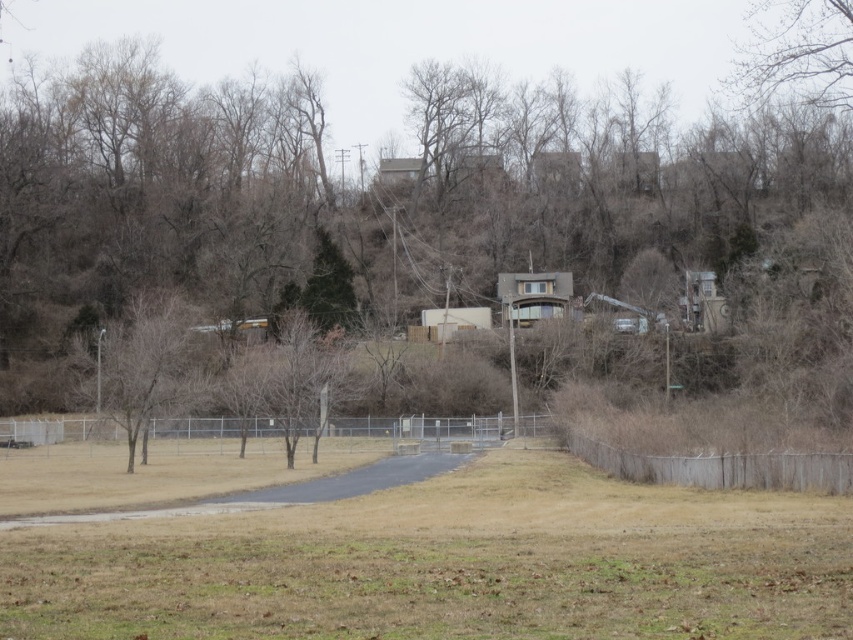
Is point (508, 268) farther from camera compared to point (126, 330)?

Yes, it is.

Who is more forward, (454, 148) or (103, 388)?

Positioned in front is point (103, 388).

Where is `brown textured tree at center`? This screenshot has width=853, height=640. brown textured tree at center is located at coordinates (437, 202).

Between brown textured tree at center and brown dry grass at lower center, which one is positioned higher?

Positioned higher is brown textured tree at center.

Between brown textured tree at center and brown dry grass at lower center, which one is positioned lower?

brown dry grass at lower center

Where is `brown textured tree at center`? brown textured tree at center is located at coordinates (437, 202).

Between point (653, 515) and point (134, 307), which one is positioned behind?

The point (134, 307) is behind.

Who is positioned more to the right, brown dry grass at lower center or brown leafless tree at left?

brown dry grass at lower center

Looking at this image, measure the distance between brown dry grass at lower center and camera.

brown dry grass at lower center and camera are 11.69 meters apart.

Image resolution: width=853 pixels, height=640 pixels. Find the location of `brown dry grass at lower center`. brown dry grass at lower center is located at coordinates (450, 564).